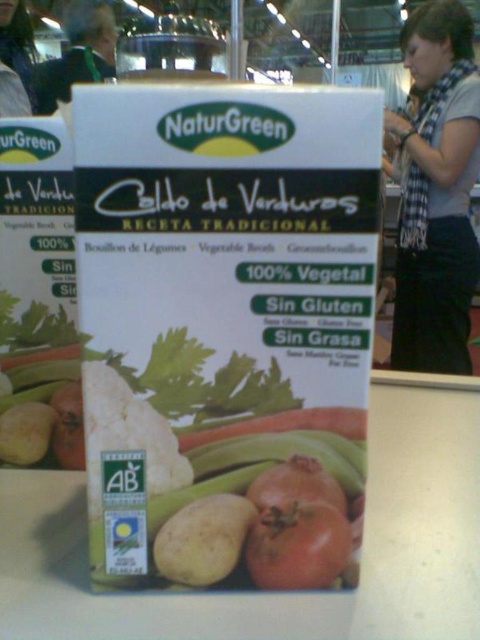
You are a customer in a store looking at the NaturGreen vegetable broth package. You notice the green fabric at upper left and the matte yellowish potato at lower left. Which object is positioned to the left of the other?

The green fabric at upper left is to the left of the matte yellowish potato at lower left.

You are a customer in a store looking at the NaturGreen vegetable broth package. There is a point marked at coordinates (78, 54) on the package. What is located at this point?

The point at coordinates (78, 54) indicates green fabric at upper left.

You are a customer looking at the NaturGreen vegetable broth package. You notice an orange smooth carrot at center and a matte yellowish potato at lower left. Which one is shorter?

The orange smooth carrot at center is shorter than the matte yellowish potato at lower left.